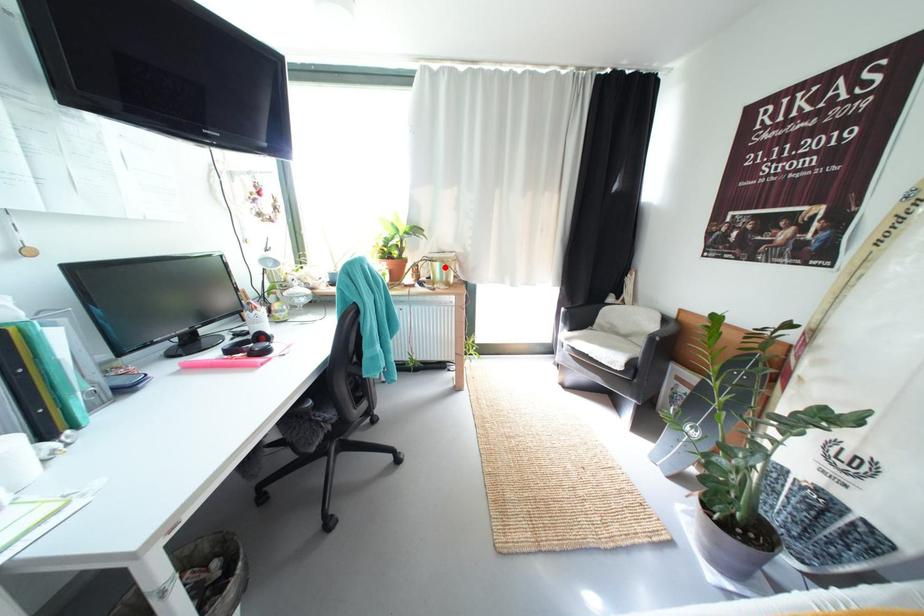
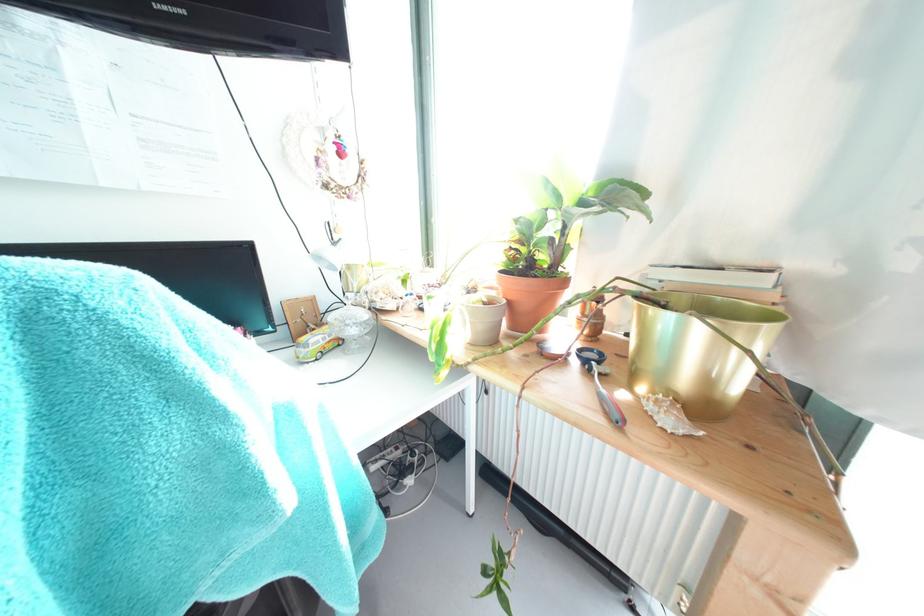
Where in the second image is the point corresponding to the highlighted location from the first image?

(675, 321)